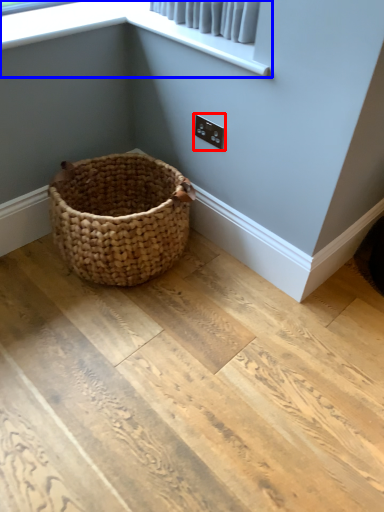
Question: Which object appears farthest to the camera in this image, electric outlet (highlighted by a red box) or window screen (highlighted by a blue box)?

Choices:
 (A) electric outlet
 (B) window screen

Answer: (A)